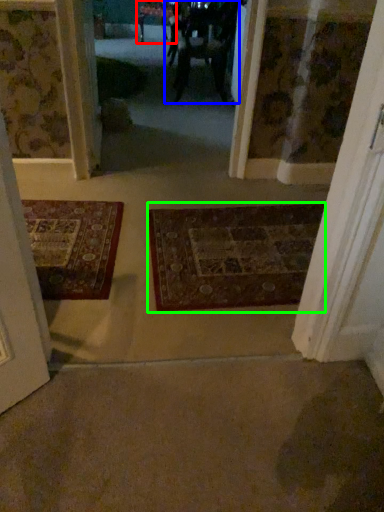
Question: Estimate the real-world distances between objects in this image. Which object is farther from furniture (highlighted by a red box), couple (highlighted by a blue box) or mat (highlighted by a green box)?

Choices:
 (A) couple
 (B) mat

Answer: (B)